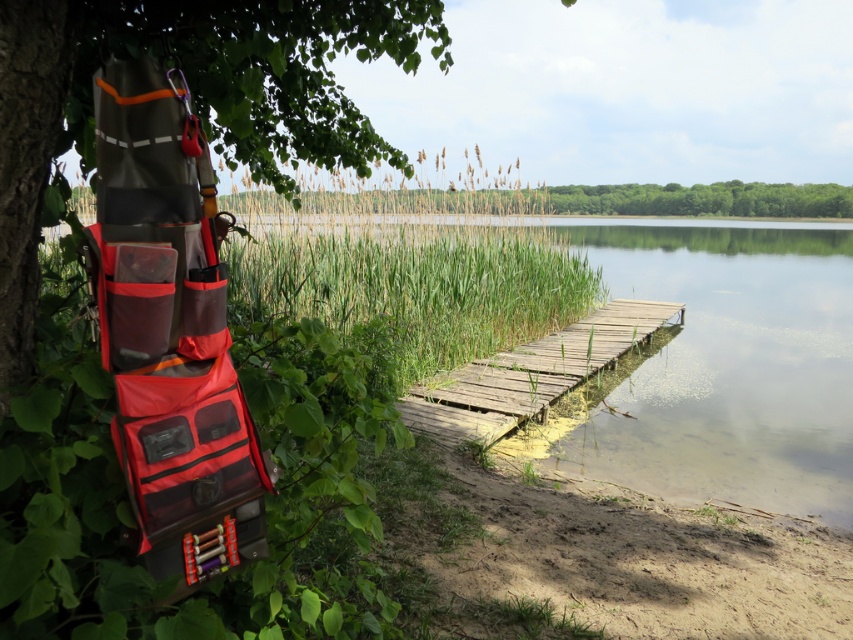
Question: Can you confirm if green grassy reed at center is thinner than green leafy tree at upper center?

Choices:
 (A) yes
 (B) no

Answer: (A)

Question: Which point appears closest to the camera in this image?

Choices:
 (A) click(743, 192)
 (B) click(13, 260)

Answer: (B)

Question: Is the position of orange fabric bag at left less distant than that of green grassy reed at center?

Choices:
 (A) no
 (B) yes

Answer: (B)

Question: Which object is the closest to the green leafy tree at upper center?

Choices:
 (A) wooden dock at center
 (B) orange fabric bag at left

Answer: (A)

Question: Does wooden dock at center appear under green leafy tree at upper center?

Choices:
 (A) no
 (B) yes

Answer: (B)

Question: Among these objects, which one is farthest from the camera?

Choices:
 (A) wooden dock at center
 (B) green leafy tree at upper center
 (C) green grassy reed at center
 (D) orange fabric bag at left

Answer: (B)